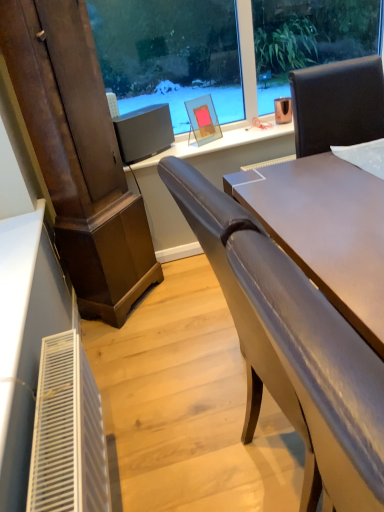
Question: From the image's perspective, is matte glass picture frame at center below matte gray chair at center?

Choices:
 (A) yes
 (B) no

Answer: (B)

Question: Does matte glass picture frame at center appear on the left side of matte gray chair at center?

Choices:
 (A) no
 (B) yes

Answer: (B)

Question: Can you confirm if matte glass picture frame at center is wider than matte gray chair at center?

Choices:
 (A) no
 (B) yes

Answer: (A)

Question: Is matte glass picture frame at center to the right of matte gray chair at center from the viewer's perspective?

Choices:
 (A) yes
 (B) no

Answer: (B)

Question: Is matte glass picture frame at center positioned with its back to matte gray chair at center?

Choices:
 (A) no
 (B) yes

Answer: (A)

Question: In the image, is matte black monitor at center on the left side or the right side of matte glass picture frame at center?

Choices:
 (A) left
 (B) right

Answer: (A)

Question: Do you think matte black monitor at center is within matte glass picture frame at center, or outside of it?

Choices:
 (A) outside
 (B) inside

Answer: (A)

Question: Considering the positions of matte black monitor at center and matte glass picture frame at center in the image, is matte black monitor at center taller or shorter than matte glass picture frame at center?

Choices:
 (A) tall
 (B) short

Answer: (B)

Question: From the image's perspective, is matte black monitor at center positioned above or below matte glass picture frame at center?

Choices:
 (A) above
 (B) below

Answer: (B)

Question: From the image's perspective, is matte glass picture frame at center located above or below matte gray chair at center?

Choices:
 (A) below
 (B) above

Answer: (B)

Question: In terms of size, does matte glass picture frame at center appear bigger or smaller than matte gray chair at center?

Choices:
 (A) big
 (B) small

Answer: (B)

Question: Is matte glass picture frame at center inside the boundaries of matte gray chair at center, or outside?

Choices:
 (A) inside
 (B) outside

Answer: (B)

Question: In terms of height, does matte glass picture frame at center look taller or shorter compared to matte gray chair at center?

Choices:
 (A) short
 (B) tall

Answer: (A)

Question: Is matte black monitor at center taller or shorter than matte gray chair at center?

Choices:
 (A) short
 (B) tall

Answer: (A)

Question: From the image's perspective, is matte black monitor at center above or below matte gray chair at center?

Choices:
 (A) below
 (B) above

Answer: (B)